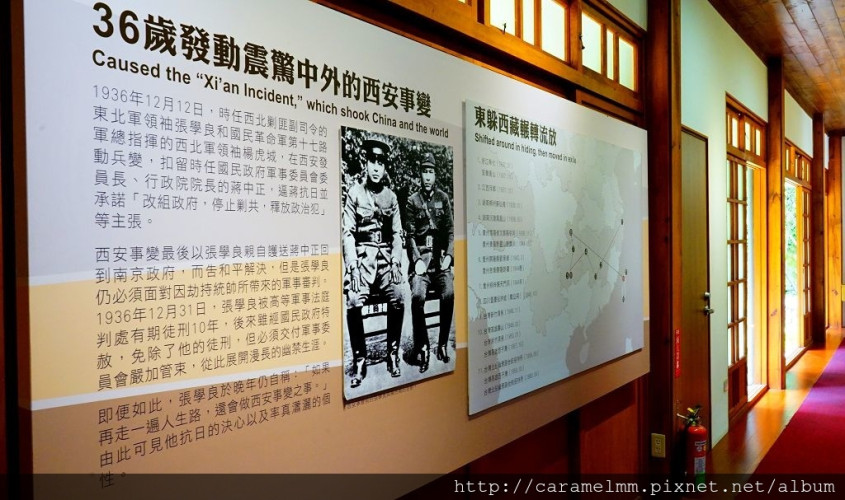
Where is `interior doorfire extinguisher`? This screenshot has height=500, width=845. interior doorfire extinguisher is located at coordinates (694, 224), (689, 449).